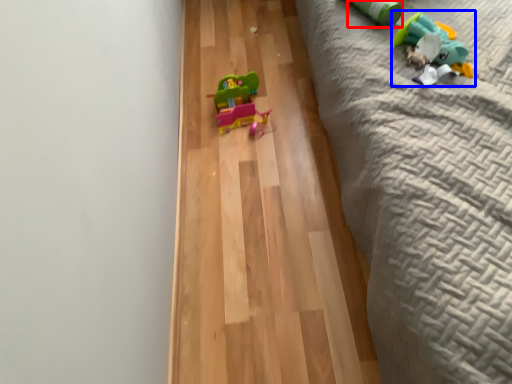
Question: Which point is closer to the camera, toy (highlighted by a red box) or toy (highlighted by a blue box)?

Choices:
 (A) toy
 (B) toy

Answer: (B)